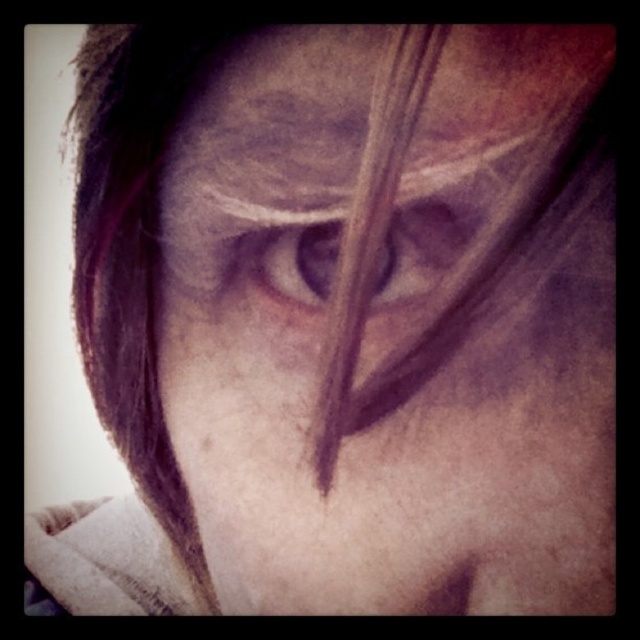
Based on the scene description, which object is wider between the matte skin at center and the brown matte eye at center?

The matte skin at center is wider than the brown matte eye at center according to the objects description.

You are a makeup artist trying to apply eyeliner between the brown matte eye at center and the matte skin eye at center. Can you fit the eyeliner between them?

The brown matte eye at center is only 0.24 inches away from the matte skin eye at center, so there is insufficient space to apply eyeliner between them.

You are a makeup artist preparing to apply eyeliner. You have a small brush and need to ensure it can reach the area between the matte skin at center and the brown matte eye at center. The brush is 1 cm long. Can the brush fit vertically between them?

The matte skin at center is above the brown matte eye at center, but the vertical distance between them isn not specified in the objects description. Therefore, it is impossible to determine if the brush will fit based on the given information.